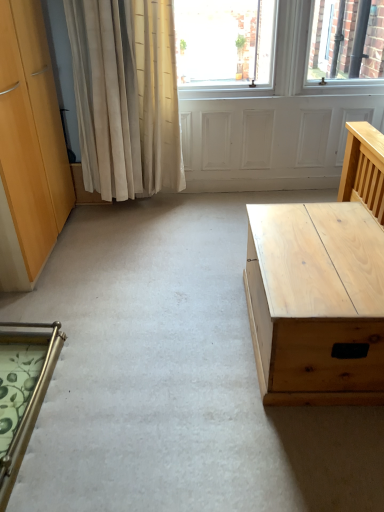
Locate an element on the screen. The height and width of the screenshot is (512, 384). free point above light wood/texture desk at right (from a real-world perspective) is located at coordinates (x=327, y=243).